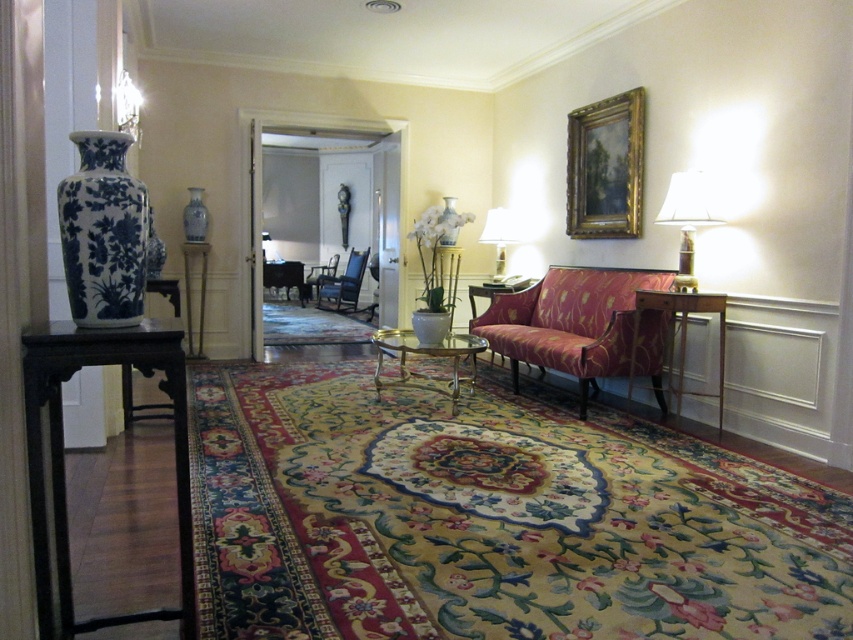
Question: In this image, where is velvet floral couch at center located relative to velvet armchair at center?

Choices:
 (A) right
 (B) left

Answer: (A)

Question: Is the position of matte gold lamp at right more distant than that of matte glass lamp at upper right?

Choices:
 (A) yes
 (B) no

Answer: (B)

Question: Which of the following is the farthest from the observer?

Choices:
 (A) blue porcelain vase at center
 (B) gold metallic coffee table at center
 (C) matte glass lamp at upper right
 (D) metallic silver tray at center

Answer: (D)

Question: Which point is farther to the camera?

Choices:
 (A) velvet floral couch at center
 (B) blue and white porcelain vase at left

Answer: (B)

Question: Estimate the real-world distances between objects in this image. Which object is farther from the matte gold lamp at right?

Choices:
 (A) velvet armchair at center
 (B) dark wood table at left
 (C) blue and white porcelain vase at upper center
 (D) wooden side table at right

Answer: (A)

Question: Is dark wood table at left positioned in front of blue fabric armchair at center?

Choices:
 (A) no
 (B) yes

Answer: (B)